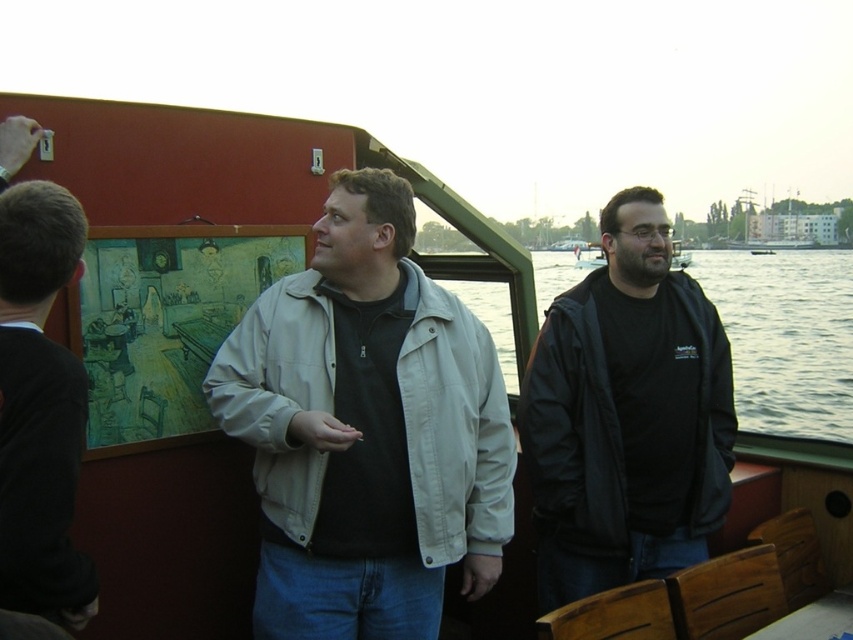
Question: Is dark gray sweater at left below clear water at right?

Choices:
 (A) yes
 (B) no

Answer: (A)

Question: Considering the real-world distances, which object is farthest from the dark gray sweater at left?

Choices:
 (A) light beige jacket at center
 (B) clear water at right
 (C) black matte jacket at center

Answer: (B)

Question: Can you confirm if light beige jacket at center is positioned to the right of dark gray sweater at left?

Choices:
 (A) no
 (B) yes

Answer: (B)

Question: Among these objects, which one is farthest from the camera?

Choices:
 (A) clear water at right
 (B) light beige jacket at center
 (C) dark gray sweater at left

Answer: (A)

Question: Can you confirm if dark gray sweater at left is bigger than clear water at right?

Choices:
 (A) yes
 (B) no

Answer: (B)

Question: Which object appears farthest from the camera in this image?

Choices:
 (A) dark gray sweater at left
 (B) black matte jacket at center
 (C) clear water at right

Answer: (C)